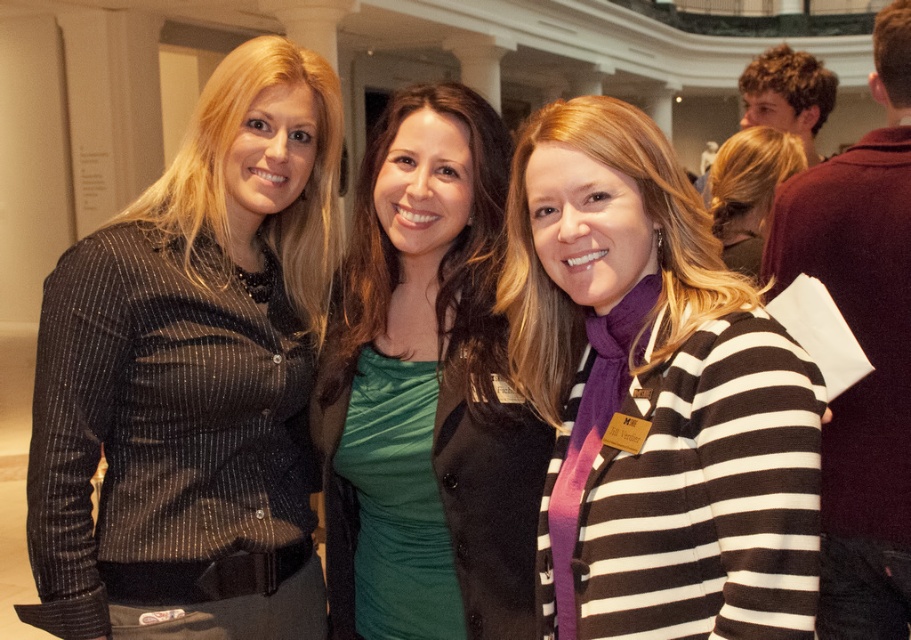
Question: Is green satin dress at center positioned at the back of matte black shirt at center?

Choices:
 (A) no
 (B) yes

Answer: (A)

Question: Which object is closer to the camera taking this photo?

Choices:
 (A) matte black blouse at left
 (B) green satin dress at center

Answer: (A)

Question: Is green satin dress at center positioned before matte black shirt at center?

Choices:
 (A) no
 (B) yes

Answer: (B)

Question: Which point is farther from the camera taking this photo?

Choices:
 (A) (735, 163)
 (B) (576, 365)
 (C) (94, 298)
 (D) (467, 131)

Answer: (A)

Question: Is matte black blouse at left in front of green satin dress at center?

Choices:
 (A) no
 (B) yes

Answer: (B)

Question: Considering the real-world distances, which object is farthest from the matte black shirt at center?

Choices:
 (A) green satin dress at center
 (B) striped sweater at center
 (C) matte black blouse at left

Answer: (C)